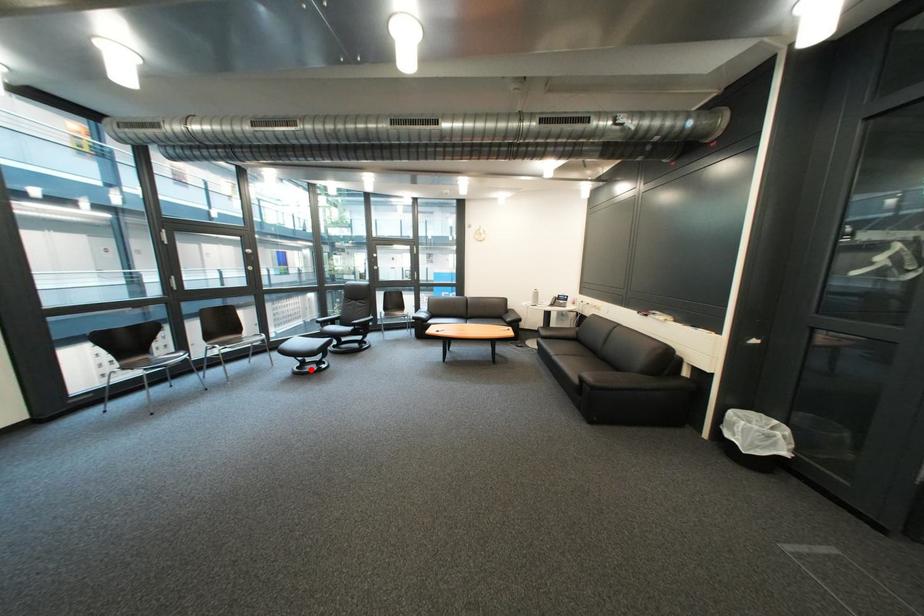
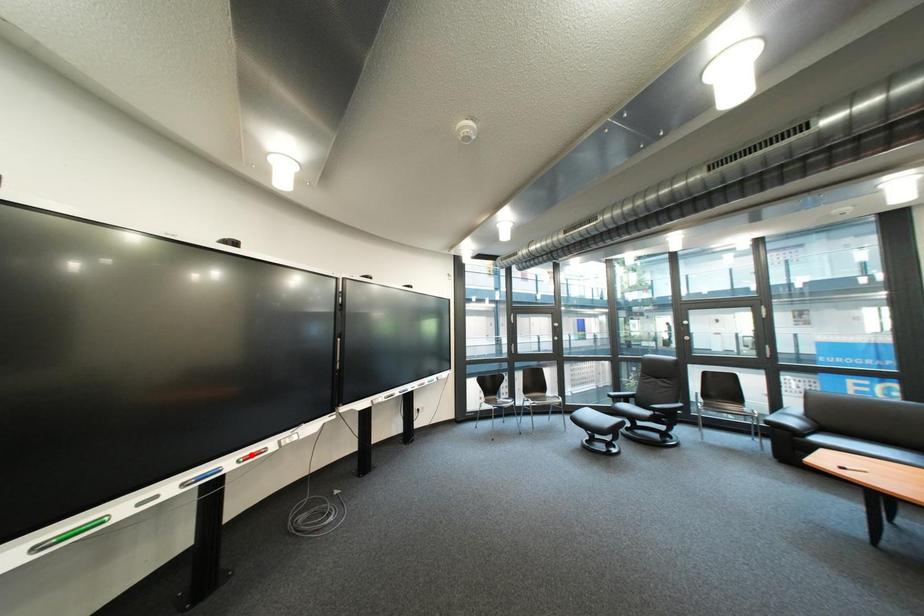
I am providing you with two images of the same scene from different viewpoints. A red point is marked on the first image and another point is marked on the second image. Are the points marked in image1 and image2 representing the same 3D position?

No